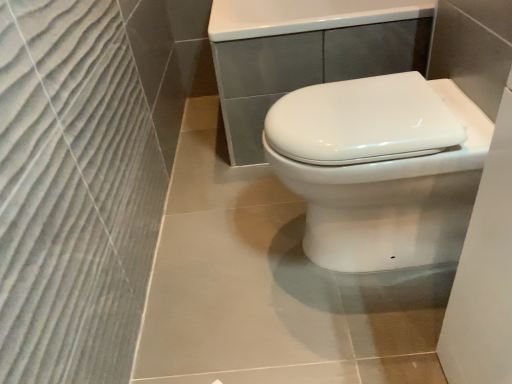
At what (x,y) coordinates should I click in order to perform the action: click on white glossy toilet at center. Please return your answer as a coordinate pair (x, y). Image resolution: width=512 pixels, height=384 pixels. Looking at the image, I should click on (380, 168).

The image size is (512, 384). Describe the element at coordinates (380, 168) in the screenshot. I see `white glossy toilet at center` at that location.

This screenshot has width=512, height=384. Identify the location of white glossy porcelain at center. (305, 53).

The width and height of the screenshot is (512, 384). What do you see at coordinates (305, 53) in the screenshot?
I see `white glossy porcelain at center` at bounding box center [305, 53].

The height and width of the screenshot is (384, 512). I want to click on white glossy toilet at center, so click(380, 168).

In the scene shown: Is white glossy porcelain at center to the right of white glossy toilet at center from the viewer's perspective?

Yes, white glossy porcelain at center is to the right of white glossy toilet at center.

Which is in front, white glossy porcelain at center or white glossy toilet at center?

white glossy toilet at center.

Is point (316, 58) positioned behind point (296, 109)?

Yes, point (316, 58) is behind point (296, 109).

From the image's perspective, is white glossy porcelain at center above or below white glossy toilet at center?

Based on their image positions, white glossy porcelain at center is located above white glossy toilet at center.

From a real-world perspective, which object rests below the other?

white glossy toilet at center, from a real-world perspective.

Considering the sizes of objects white glossy porcelain at center and white glossy toilet at center in the image provided, who is thinner, white glossy porcelain at center or white glossy toilet at center?

white glossy toilet at center.

Is white glossy porcelain at center shorter than white glossy toilet at center?

In fact, white glossy porcelain at center may be taller than white glossy toilet at center.

Does white glossy porcelain at center have a larger size compared to white glossy toilet at center?

Correct, white glossy porcelain at center is larger in size than white glossy toilet at center.

Looking at this image, which is correct: white glossy porcelain at center is inside white glossy toilet at center, or outside of it?

white glossy porcelain at center cannot be found inside white glossy toilet at center.

Are white glossy porcelain at center and white glossy toilet at center far apart?

No.

Is white glossy porcelain at center positioned with its back to white glossy toilet at center?

No, white glossy porcelain at center is not facing away from white glossy toilet at center.

Measure the distance between white glossy porcelain at center and white glossy toilet at center.

A distance of 17.61 inches exists between white glossy porcelain at center and white glossy toilet at center.

Locate an element on the screen. The image size is (512, 384). toilet beneath the white glossy porcelain at center (from a real-world perspective) is located at coordinates (380, 168).

Looking at this image, which is more to the right, white glossy toilet at center or white glossy porcelain at center?

white glossy porcelain at center is more to the right.

From the picture: Is white glossy toilet at center positioned in front of white glossy porcelain at center?

Yes.

Which is nearer, [352,171] or [287,11]?

Point [352,171] is closer to the camera than point [287,11].

From the image's perspective, who appears lower, white glossy toilet at center or white glossy porcelain at center?

white glossy toilet at center.

From a real-world perspective, which object rests below the other?

white glossy toilet at center is physically lower.

Is white glossy toilet at center wider than white glossy porcelain at center?

No.

In the scene shown: Which of these two, white glossy toilet at center or white glossy porcelain at center, stands shorter?

white glossy toilet at center is shorter.

From the picture: Who is bigger, white glossy toilet at center or white glossy porcelain at center?

white glossy porcelain at center is bigger.

Is white glossy toilet at center not inside white glossy porcelain at center?

white glossy toilet at center lies outside white glossy porcelain at center's area.

Consider the image. Is white glossy toilet at center beside white glossy porcelain at center?

No, white glossy toilet at center is not beside white glossy porcelain at center.

Is white glossy toilet at center looking in the opposite direction of white glossy porcelain at center?

No, white glossy toilet at center is not facing the opposite direction of white glossy porcelain at center.

What's the angular difference between white glossy toilet at center and white glossy porcelain at center's facing directions?

0.262 degrees separate the facing orientations of white glossy toilet at center and white glossy porcelain at center.

How distant is white glossy toilet at center from white glossy porcelain at center?

They are 17.61 inches apart.

Locate an element on the screen. This screenshot has height=384, width=512. porcelain above the white glossy toilet at center (from a real-world perspective) is located at coordinates (305, 53).

At what (x,y) coordinates should I click in order to perform the action: click on toilet to the left of white glossy porcelain at center. Please return your answer as a coordinate pair (x, y). Looking at the image, I should click on (380, 168).

At what (x,y) coordinates should I click in order to perform the action: click on porcelain behind the white glossy toilet at center. Please return your answer as a coordinate pair (x, y). Looking at the image, I should click on (305, 53).